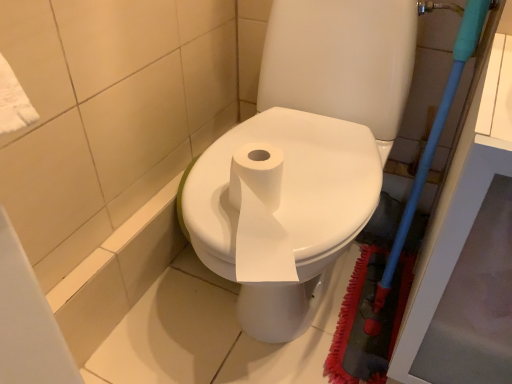
Question: Is white glossy toilet at center oriented away from blue plastic brush at right?

Choices:
 (A) no
 (B) yes

Answer: (A)

Question: Does white glossy toilet at center appear on the right side of blue plastic brush at right?

Choices:
 (A) no
 (B) yes

Answer: (A)

Question: Is white glossy toilet at center in contact with blue plastic brush at right?

Choices:
 (A) yes
 (B) no

Answer: (B)

Question: Is white glossy toilet at center smaller than blue plastic brush at right?

Choices:
 (A) yes
 (B) no

Answer: (B)

Question: From a real-world perspective, is white glossy toilet at center below blue plastic brush at right?

Choices:
 (A) no
 (B) yes

Answer: (A)

Question: Is white glossy toilet at center not inside blue plastic brush at right?

Choices:
 (A) yes
 (B) no

Answer: (A)

Question: Does blue plastic brush at right have a smaller size compared to white glossy toilet at center?

Choices:
 (A) yes
 (B) no

Answer: (A)

Question: Is white glossy toilet at center at the back of blue plastic brush at right?

Choices:
 (A) yes
 (B) no

Answer: (B)

Question: Does blue plastic brush at right have a lesser width compared to white glossy toilet at center?

Choices:
 (A) yes
 (B) no

Answer: (A)

Question: Are blue plastic brush at right and white glossy toilet at center located far from each other?

Choices:
 (A) yes
 (B) no

Answer: (B)

Question: Does blue plastic brush at right appear on the right side of white glossy toilet at center?

Choices:
 (A) yes
 (B) no

Answer: (A)

Question: Could white glossy toilet at center be considered to be inside blue plastic brush at right?

Choices:
 (A) no
 (B) yes

Answer: (A)

Question: From the image's perspective, is white glossy toilet at center positioned above or below blue plastic brush at right?

Choices:
 (A) above
 (B) below

Answer: (A)